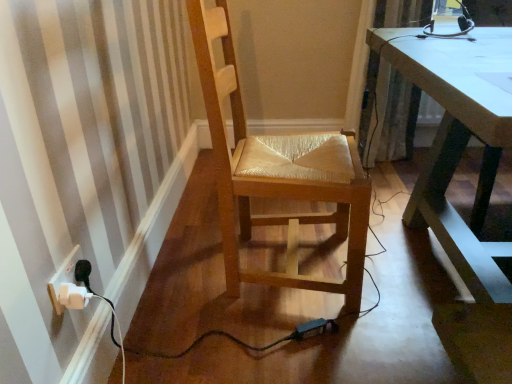
I want to click on vacant space underneath wooden woven seat at center (from a real-world perspective), so click(x=292, y=261).